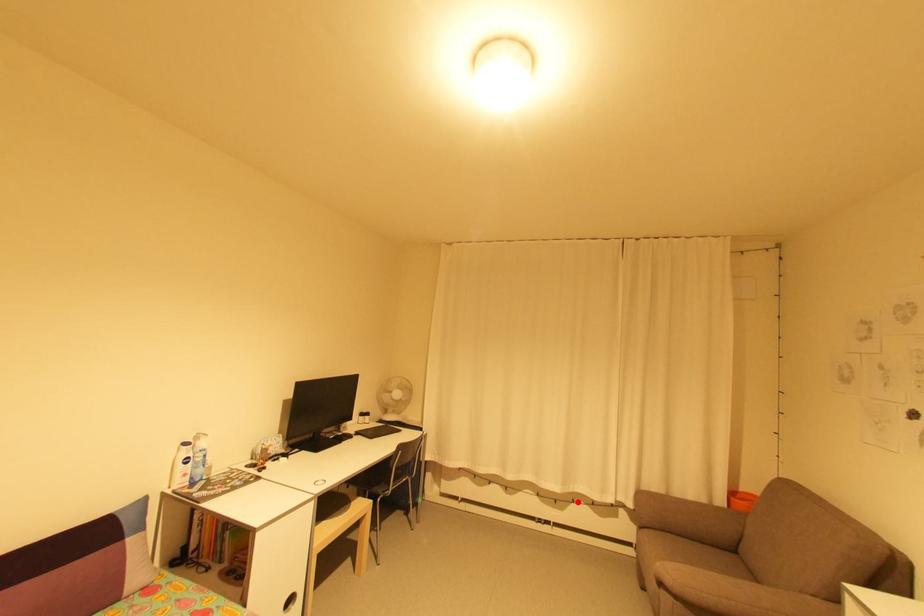
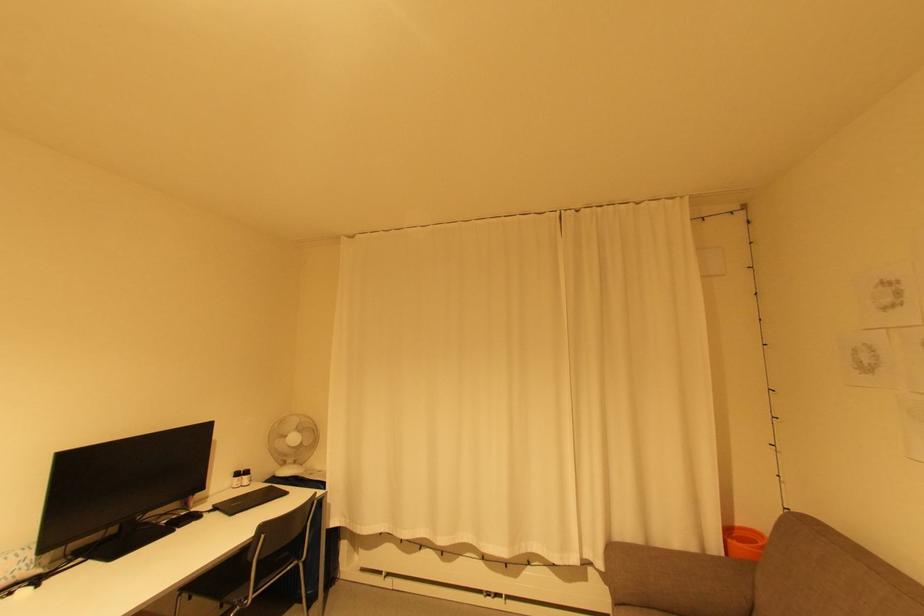
Where in the second image is the point corresponding to the highlighted location from the first image?

(533, 564)